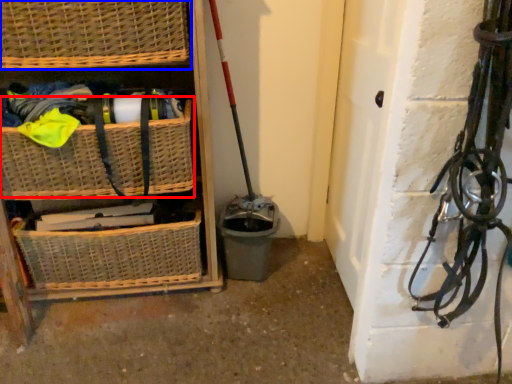
Question: Which object appears farthest to the camera in this image, basket (highlighted by a red box) or basket (highlighted by a blue box)?

Choices:
 (A) basket
 (B) basket

Answer: (A)